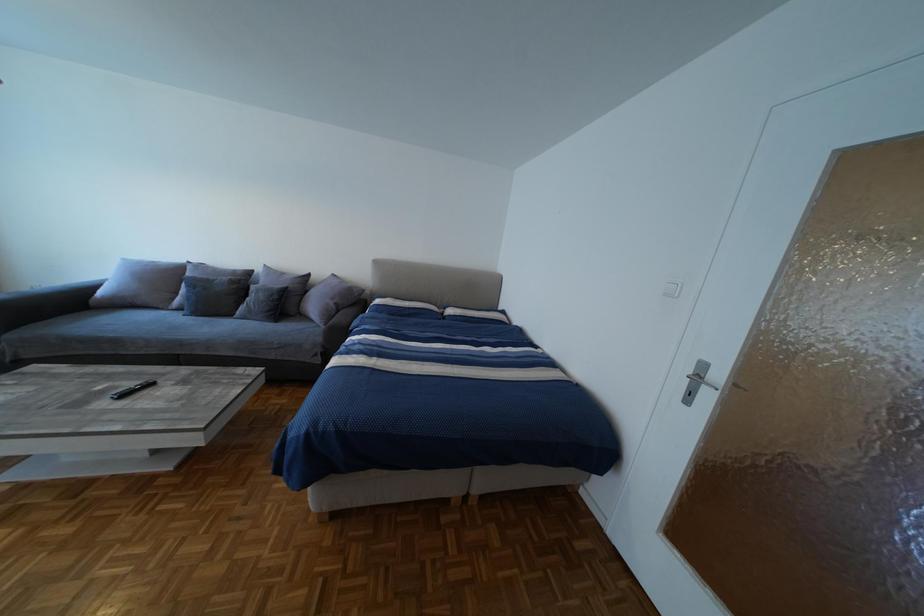
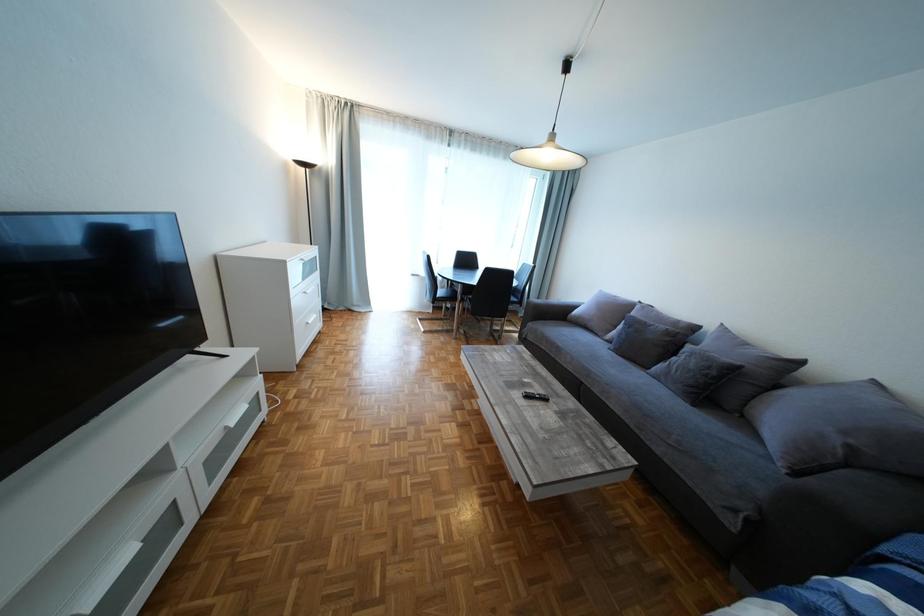
Question: The camera is either moving clockwise (left) or counter-clockwise (right) around the object. The first image is from the beginning of the video and the second image is from the end. Is the camera moving left or right when shooting the video?

Choices:
 (A) Left
 (B) Right

Answer: (B)